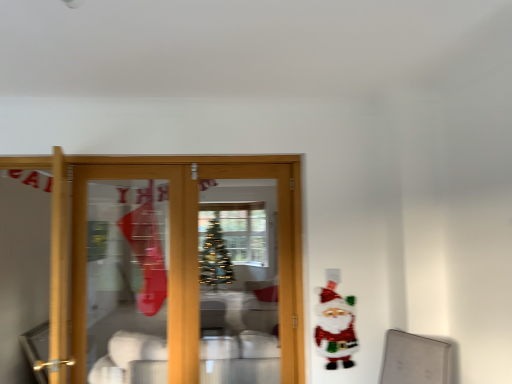
Image resolution: width=512 pixels, height=384 pixels. Describe the element at coordinates (335, 327) in the screenshot. I see `shiny sequined santa claus at right` at that location.

Where is `shiny sequined santa claus at right`? shiny sequined santa claus at right is located at coordinates (335, 327).

Find the location of a particular element. The image size is (512, 384). white glossy bowls at center is located at coordinates (240, 359).

Image resolution: width=512 pixels, height=384 pixels. Describe the element at coordinates (240, 359) in the screenshot. I see `white glossy bowls at center` at that location.

Locate an element on the screen. The height and width of the screenshot is (384, 512). shiny sequined santa claus at right is located at coordinates (335, 327).

In the image, is white glossy bowls at center on the left side or the right side of shiny sequined santa claus at right?

From the image, it's evident that white glossy bowls at center is to the left of shiny sequined santa claus at right.

Does white glossy bowls at center come behind shiny sequined santa claus at right?

Yes, the depth of white glossy bowls at center is greater than that of shiny sequined santa claus at right.

Which is nearer, (234, 345) or (357, 341)?

The point (357, 341) is closer to the camera.

From the image's perspective, is white glossy bowls at center located above shiny sequined santa claus at right?

No.

Looking at this image, from a real-world perspective, is white glossy bowls at center above or below shiny sequined santa claus at right?

Clearly, from a real-world perspective, white glossy bowls at center is below shiny sequined santa claus at right.

Which of these two, white glossy bowls at center or shiny sequined santa claus at right, is thinner?

With smaller width is shiny sequined santa claus at right.

Looking at this image, which of these two, white glossy bowls at center or shiny sequined santa claus at right, stands shorter?

shiny sequined santa claus at right is shorter.

Does white glossy bowls at center have a larger size compared to shiny sequined santa claus at right?

Correct, white glossy bowls at center is larger in size than shiny sequined santa claus at right.

Is white glossy bowls at center located outside shiny sequined santa claus at right?

That's correct, white glossy bowls at center is outside of shiny sequined santa claus at right.

Is white glossy bowls at center placed right next to shiny sequined santa claus at right?

No, white glossy bowls at center is not with shiny sequined santa claus at right.

Is white glossy bowls at center looking in the opposite direction of shiny sequined santa claus at right?

No, shiny sequined santa claus at right is not at the back of white glossy bowls at center.

Can you tell me how much white glossy bowls at center and shiny sequined santa claus at right differ in facing direction?

They differ by 177 degrees in their facing directions.

Locate an element on the screen. The height and width of the screenshot is (384, 512). santa claus in front of the white glossy bowls at center is located at coordinates (335, 327).

Does shiny sequined santa claus at right appear on the right side of white glossy bowls at center?

Yes, shiny sequined santa claus at right is to the right of white glossy bowls at center.

Does shiny sequined santa claus at right come in front of white glossy bowls at center?

Yes, shiny sequined santa claus at right is in front of white glossy bowls at center.

Which is behind, point (329, 328) or point (153, 374)?

The point (153, 374) is more distant.

From the image's perspective, between shiny sequined santa claus at right and white glossy bowls at center, which one is located above?

shiny sequined santa claus at right.

From a real-world perspective, is shiny sequined santa claus at right physically above white glossy bowls at center?

Indeed, from a real-world perspective, shiny sequined santa claus at right stands above white glossy bowls at center.

Considering the relative sizes of shiny sequined santa claus at right and white glossy bowls at center in the image provided, is shiny sequined santa claus at right wider than white glossy bowls at center?

Incorrect, the width of shiny sequined santa claus at right does not surpass that of white glossy bowls at center.

Is shiny sequined santa claus at right taller or shorter than white glossy bowls at center?

In the image, shiny sequined santa claus at right appears to be shorter than white glossy bowls at center.

Based on their sizes in the image, would you say shiny sequined santa claus at right is bigger or smaller than white glossy bowls at center?

In the image, shiny sequined santa claus at right appears to be smaller than white glossy bowls at center.

In the scene shown: Is shiny sequined santa claus at right completely or partially outside of white glossy bowls at center?

Yes, shiny sequined santa claus at right is located beyond the bounds of white glossy bowls at center.

Are shiny sequined santa claus at right and white glossy bowls at center located far from each other?

No, shiny sequined santa claus at right is in close proximity to white glossy bowls at center.

Is shiny sequined santa claus at right oriented away from white glossy bowls at center?

shiny sequined santa claus at right is not turned away from white glossy bowls at center.

Where is `furniture behind the shiny sequined santa claus at right`? This screenshot has width=512, height=384. furniture behind the shiny sequined santa claus at right is located at coordinates (240, 359).

Locate an element on the screen. santa claus located above the white glossy bowls at center (from the image's perspective) is located at coordinates (335, 327).

There is a white glossy bowls at center. Where is `santa claus above it (from a real-world perspective)`? This screenshot has height=384, width=512. santa claus above it (from a real-world perspective) is located at coordinates (335, 327).